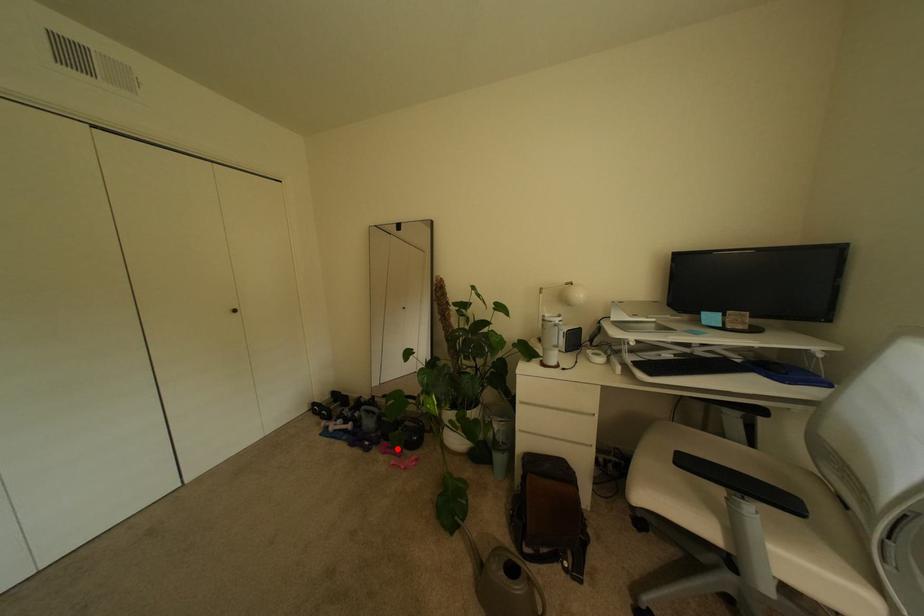
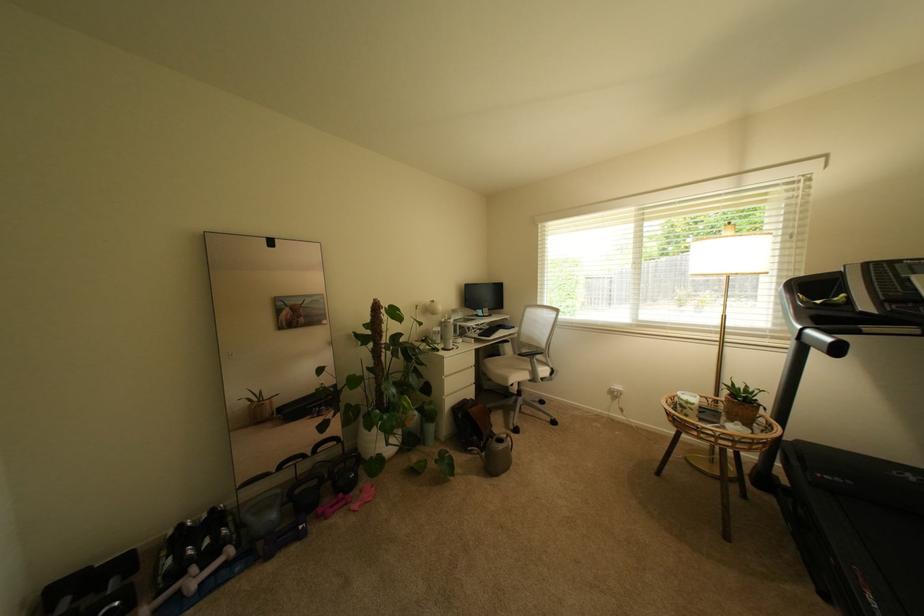
The point at the highlighted location is marked in the first image. Where is the corresponding point in the second image?

(339, 508)